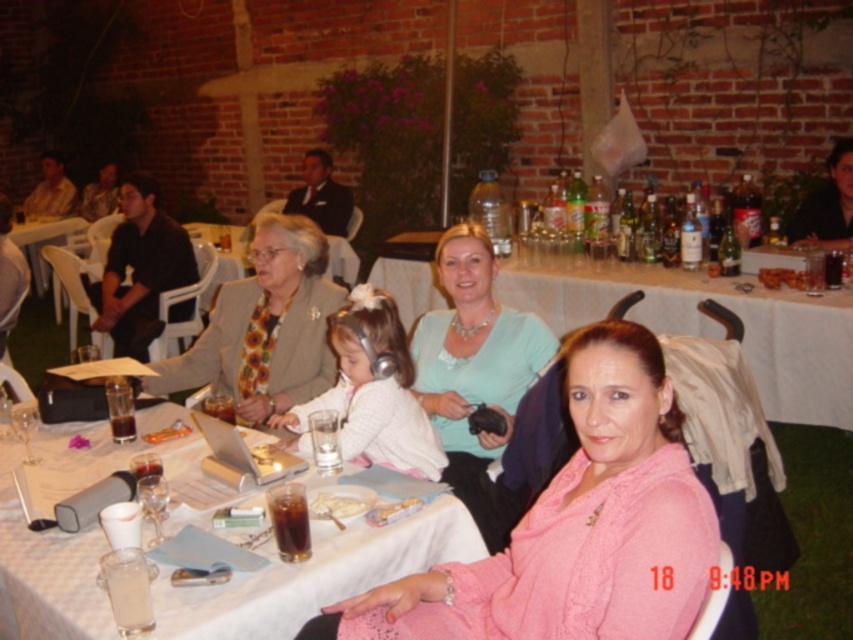
Does light blue fabric shirt at center have a greater height compared to black leather jacket at upper right?

Yes, light blue fabric shirt at center is taller than black leather jacket at upper right.

Does light blue fabric shirt at center appear over black leather jacket at upper right?

No, light blue fabric shirt at center is not above black leather jacket at upper right.

Which is in front, point (485, 268) or point (813, 230)?

Point (485, 268) is in front.

Find the location of a particular element. light blue fabric shirt at center is located at coordinates (474, 372).

Between white plastic table at lower left and orange plastic toy at center, which one is positioned lower?

orange plastic toy at center

From the picture: Between white plastic table at lower left and orange plastic toy at center, which one appears on the right side from the viewer's perspective?

orange plastic toy at center is more to the right.

Is point (77, 216) in front of point (149, 442)?

No, (77, 216) is behind (149, 442).

The width and height of the screenshot is (853, 640). What are the coordinates of `white plastic table at lower left` in the screenshot? It's located at (44, 243).

Is point (425, 385) farther from viewer compared to point (318, 513)?

That is True.

Which is below, light blue fabric shirt at center or white creamy food at table center?

white creamy food at table center is below.

The width and height of the screenshot is (853, 640). Find the location of `light blue fabric shirt at center`. light blue fabric shirt at center is located at coordinates (474, 372).